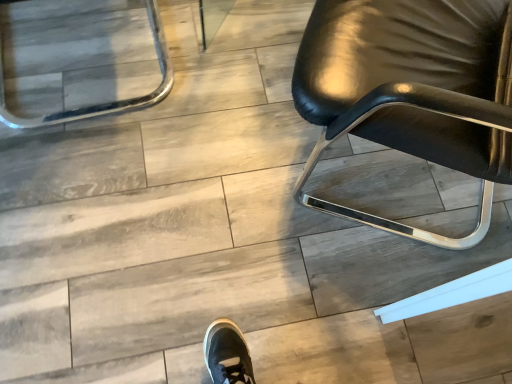
The image size is (512, 384). I want to click on vacant space underneath glossy black chair at right, the 2th chair in the left-to-right sequence (from a real-world perspective), so click(391, 189).